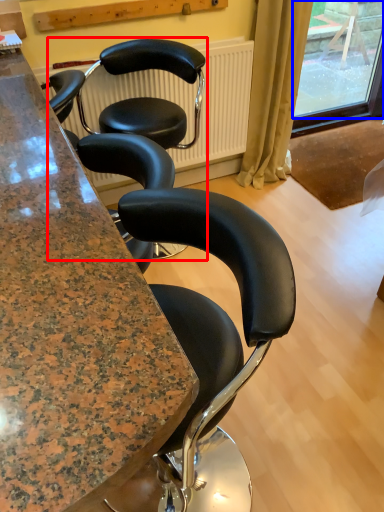
Question: Which point is closer to the camera, chair (highlighted by a red box) or window screen (highlighted by a blue box)?

Choices:
 (A) chair
 (B) window screen

Answer: (A)